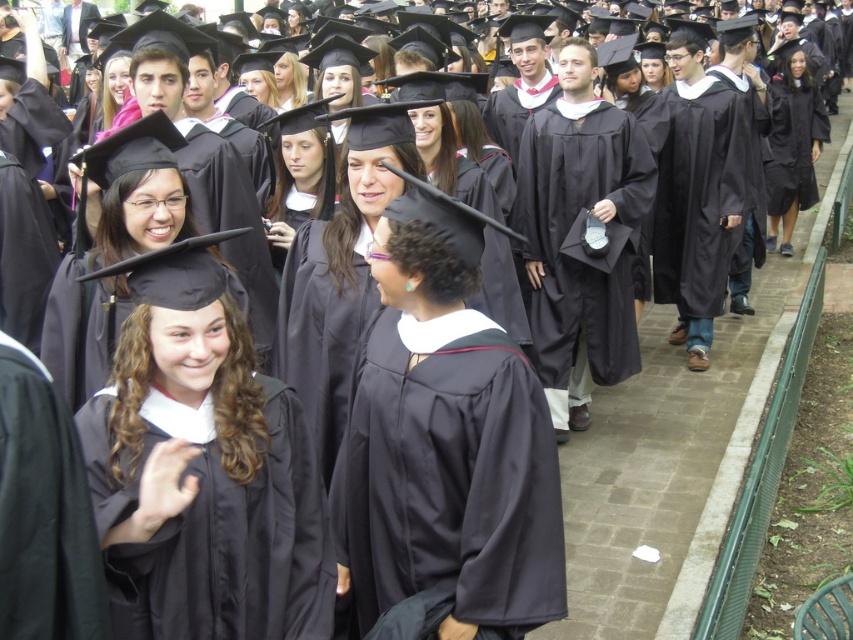
Question: Can you confirm if black matte graduation gown at center is bigger than matte black gown at center?

Choices:
 (A) no
 (B) yes

Answer: (A)

Question: Among these objects, which one is farthest from the camera?

Choices:
 (A) matte black gown at center
 (B) matte black gown at lower left

Answer: (A)

Question: Which of the following is the farthest from the observer?

Choices:
 (A) black matte graduation gown at center
 (B) matte black gown at center
 (C) black matte graduation gown at lower left

Answer: (B)

Question: Is matte black gown at lower left above matte black gown at center?

Choices:
 (A) no
 (B) yes

Answer: (A)

Question: Is matte black gown at center to the right of black matte graduation gown at lower left from the viewer's perspective?

Choices:
 (A) no
 (B) yes

Answer: (B)

Question: Which is farther from the black matte graduation gown at center?

Choices:
 (A) matte black gown at center
 (B) matte black gown at lower left
 (C) black matte graduation gown at lower left

Answer: (A)